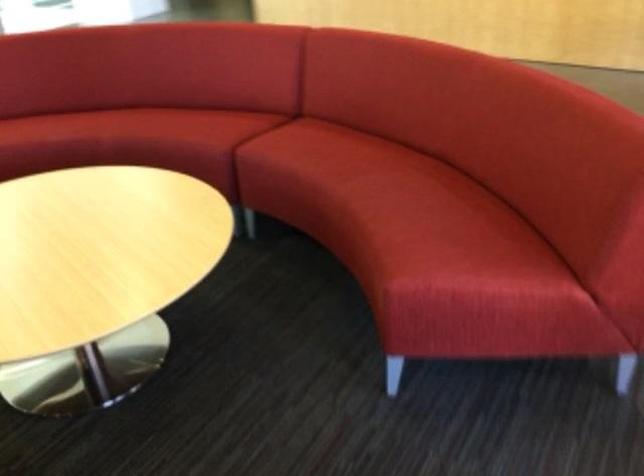
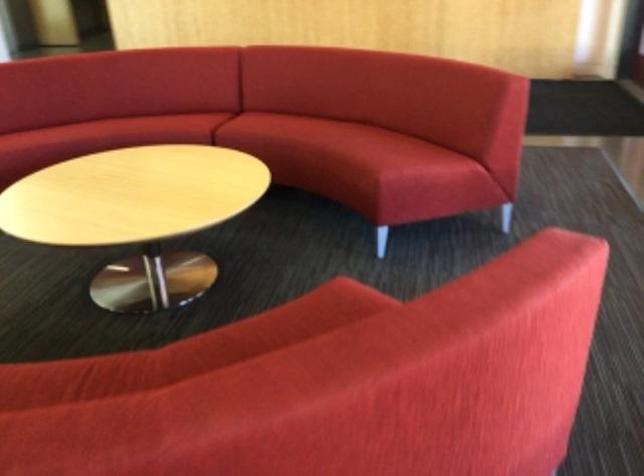
Locate, in the second image, the point that corresponds to point 368,180 in the first image.

(326, 134)